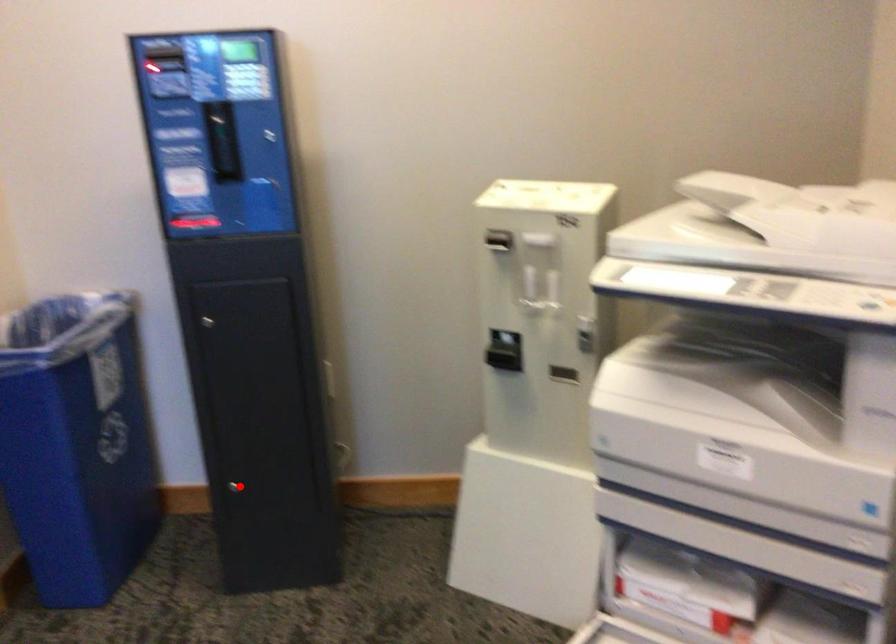
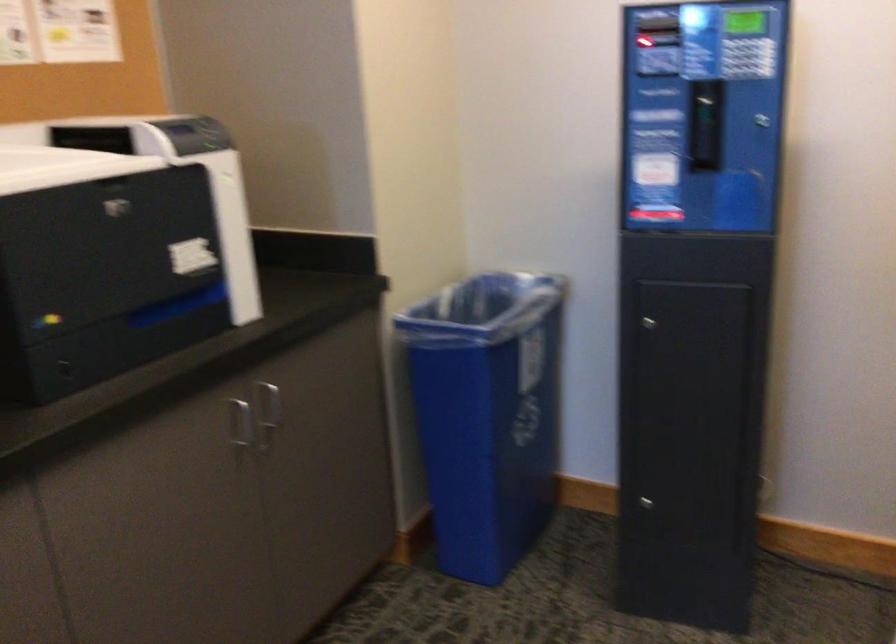
Where in the second image is the point corresponding to the highlighted location from the first image?

(648, 504)